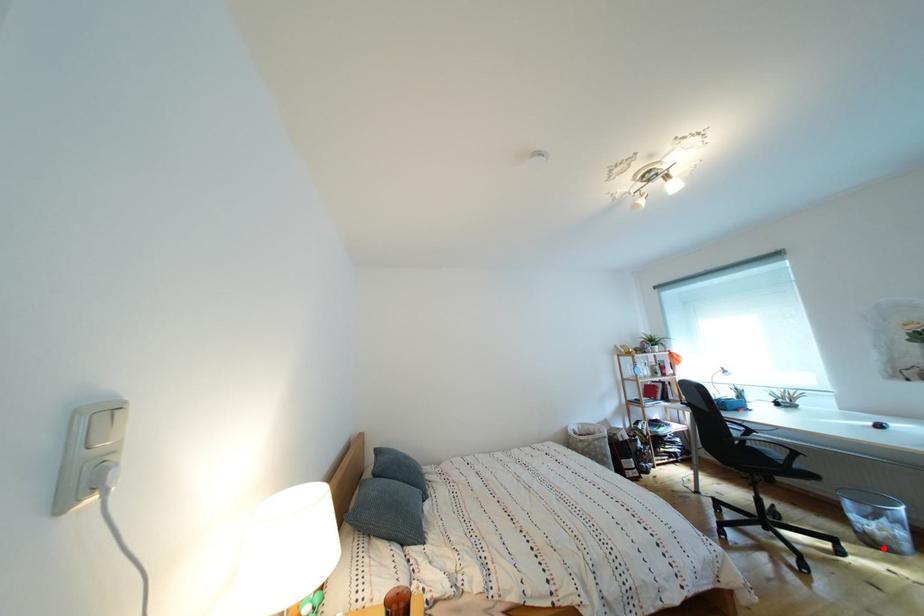
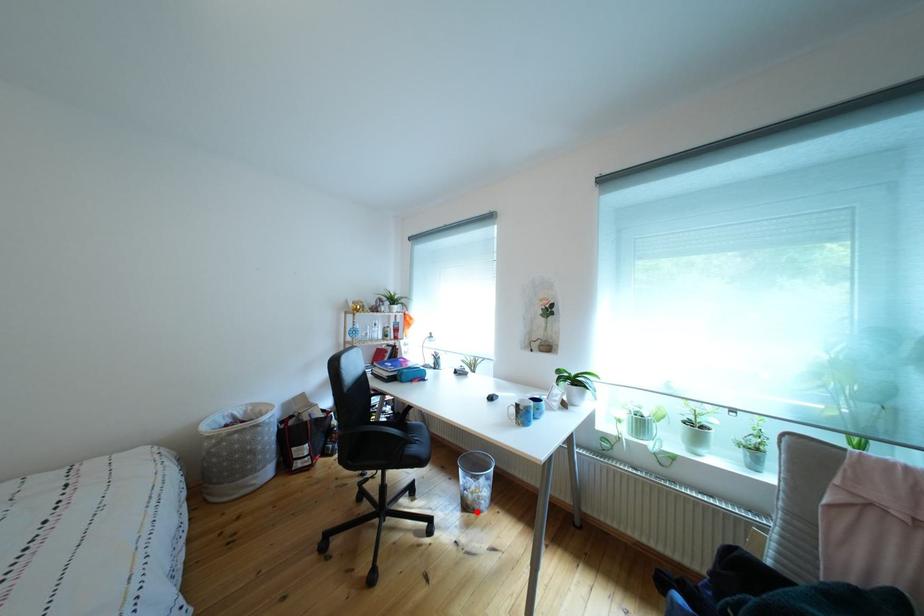
I am providing you with two images of the same scene from different viewpoints. A red point is marked on the first image and another point is marked on the second image. Does the point marked in image1 correspond to the same location as the one in image2?

Yes